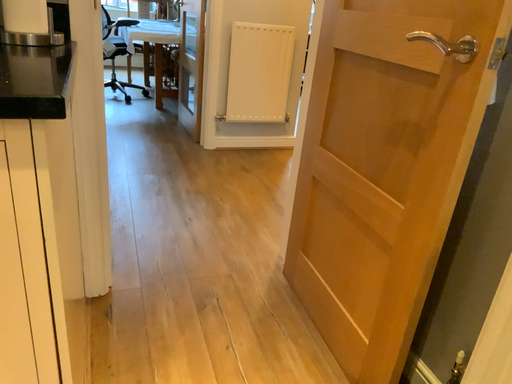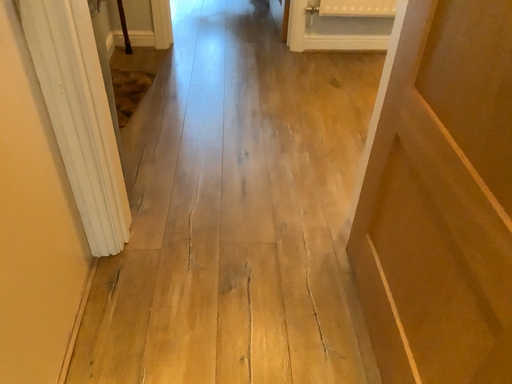
Question: Which way did the camera rotate in the video?

Choices:
 (A) rotated left
 (B) rotated right

Answer: (A)